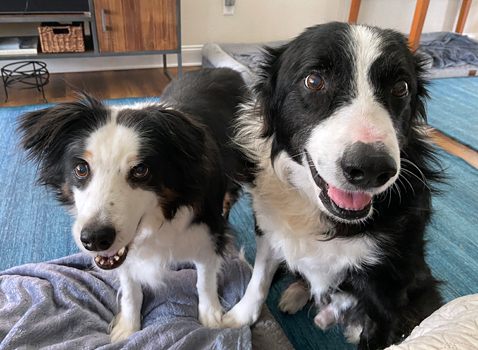
This screenshot has height=350, width=478. In order to click on metal table in this screenshot , I will do `click(33, 71)`.